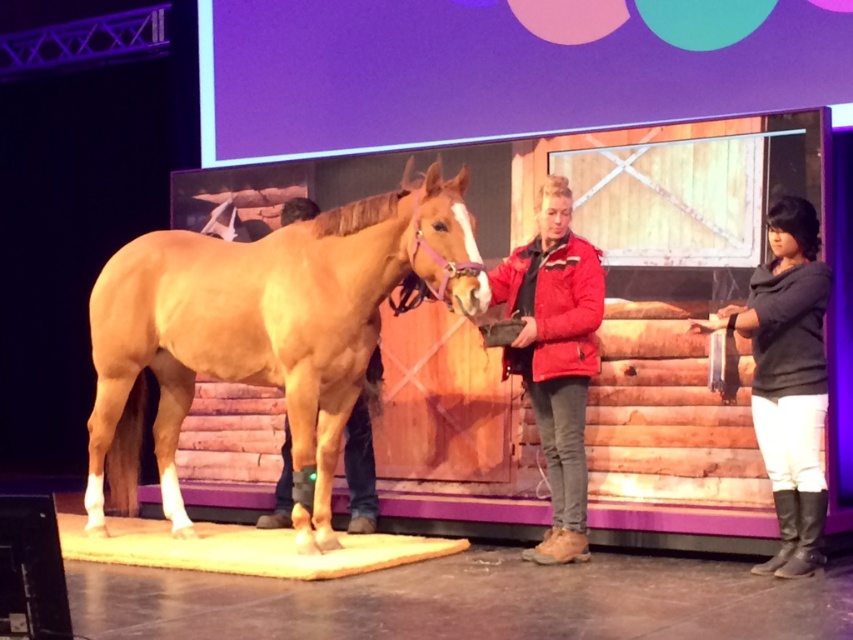
Question: Which point appears farthest from the camera in this image?

Choices:
 (A) (798, 257)
 (B) (460, 180)

Answer: (A)

Question: In this image, where is golden-brown leather horse at center located relative to dark gray sweater at right?

Choices:
 (A) below
 (B) above

Answer: (A)

Question: Estimate the real-world distances between objects in this image. Which object is farther from the red jacket at center?

Choices:
 (A) golden-brown leather horse at center
 (B) dark gray sweater at right

Answer: (A)

Question: Which point appears closest to the camera in this image?

Choices:
 (A) (547, 244)
 (B) (343, 387)

Answer: (B)

Question: Is golden-brown leather horse at center smaller than red jacket at center?

Choices:
 (A) yes
 (B) no

Answer: (B)

Question: Does dark gray sweater at right lie behind red jacket at center?

Choices:
 (A) yes
 (B) no

Answer: (B)